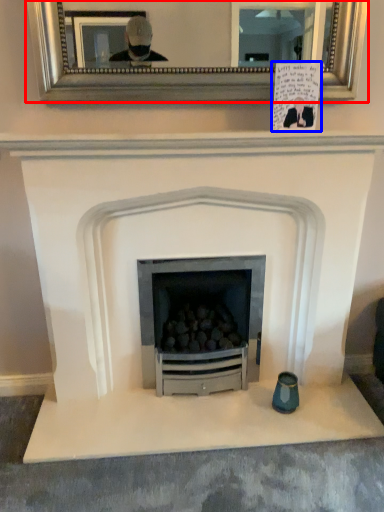
Question: Which object appears closest to the camera in this image, picture frame (highlighted by a red box) or postcard (highlighted by a blue box)?

Choices:
 (A) picture frame
 (B) postcard

Answer: (A)